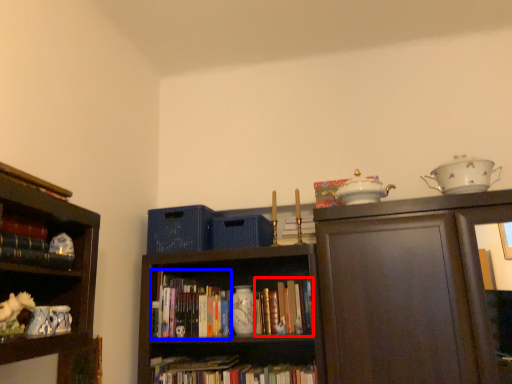
Question: Which of the following is the closest to the observer, book (highlighted by a red box) or book (highlighted by a blue box)?

Choices:
 (A) book
 (B) book

Answer: (A)